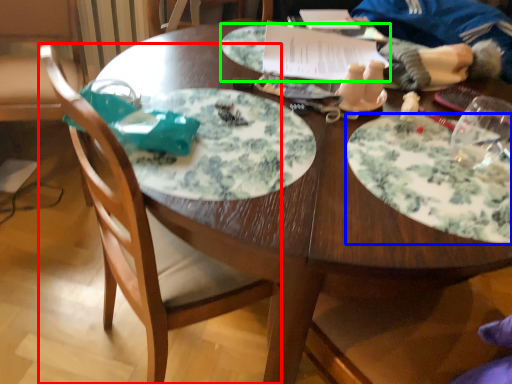
Question: Based on their relative distances, which object is farther from chair (highlighted by a red box)? Choose from plate (highlighted by a blue box) and platter (highlighted by a green box).

Choices:
 (A) plate
 (B) platter

Answer: (B)